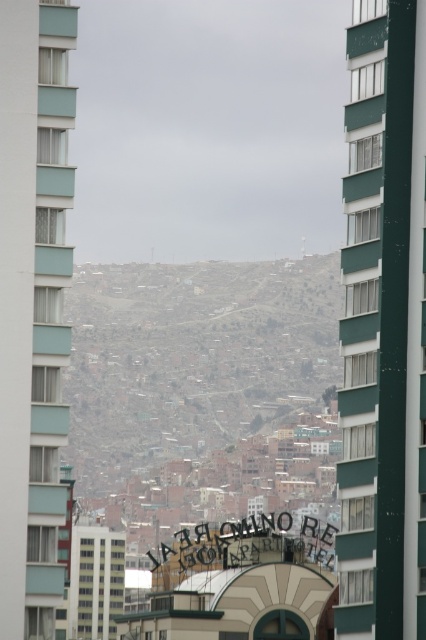
Question: From the image, what is the correct spatial relationship of green glass building at right in relation to white concrete building at center?

Choices:
 (A) below
 (B) above

Answer: (B)

Question: Does green glass building at right appear under white concrete building at center?

Choices:
 (A) yes
 (B) no

Answer: (B)

Question: Among these objects, which one is farthest from the camera?

Choices:
 (A) teal glass building at left
 (B) green glass building at right

Answer: (A)

Question: Which object is positioned closest to the green glass building at right?

Choices:
 (A) white concrete building at center
 (B) teal glass building at left

Answer: (B)

Question: Is green glass building at right closer to the viewer compared to teal glass building at left?

Choices:
 (A) no
 (B) yes

Answer: (B)

Question: Which of these objects is positioned farthest from the brown textured buildings at center?

Choices:
 (A) green glass building at right
 (B) white concrete building at center
 (C) teal glass building at left

Answer: (C)